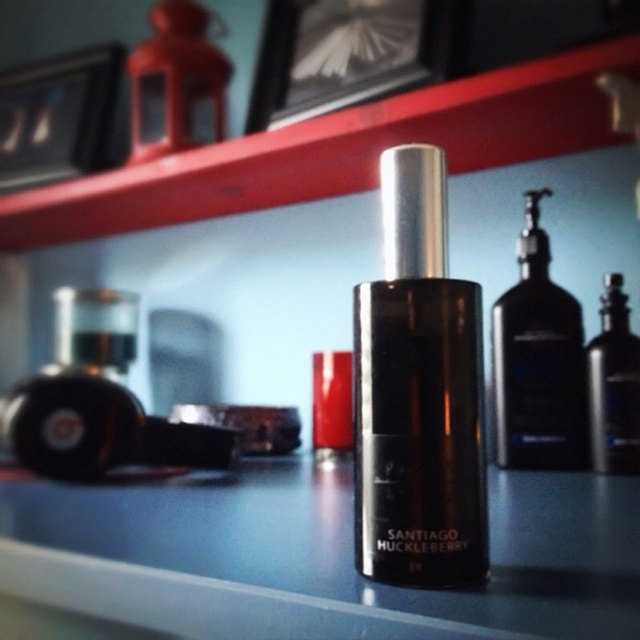
You are a customer in a perfume store and want to pick up the bottle at point [259,204] and the one at point [548,392]. Which bottle will you reach first if you move towards them from your current position?

You will reach the bottle at point [259,204] first because it is closer to you than the bottle at point [548,392], which is further away.

You are organizing a perfume display and need to place both the black glass bottle at center and the black matte bottle at center on a shelf. If the shelf has a height limit of 10 cm, which bottle can you place without exceeding the height limit?

The black glass bottle at center is shorter than the black matte bottle at center, so the black glass bottle at center can be placed without exceeding the height limit if it is under 10 cm. However, the exact height of the black glass bottle at center is not provided, so we cannot confirm if it fits without additional information.